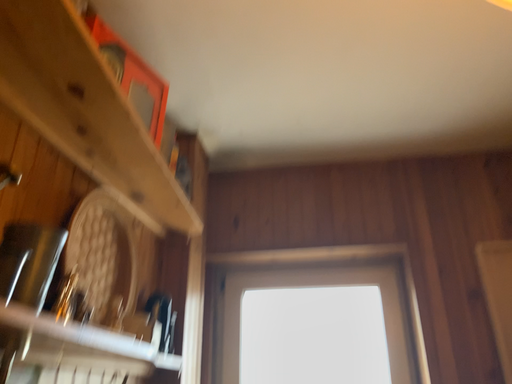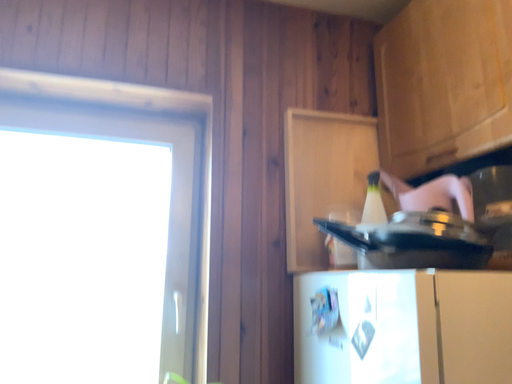
Question: How did the camera likely rotate when shooting the video?

Choices:
 (A) rotated right
 (B) rotated left

Answer: (A)